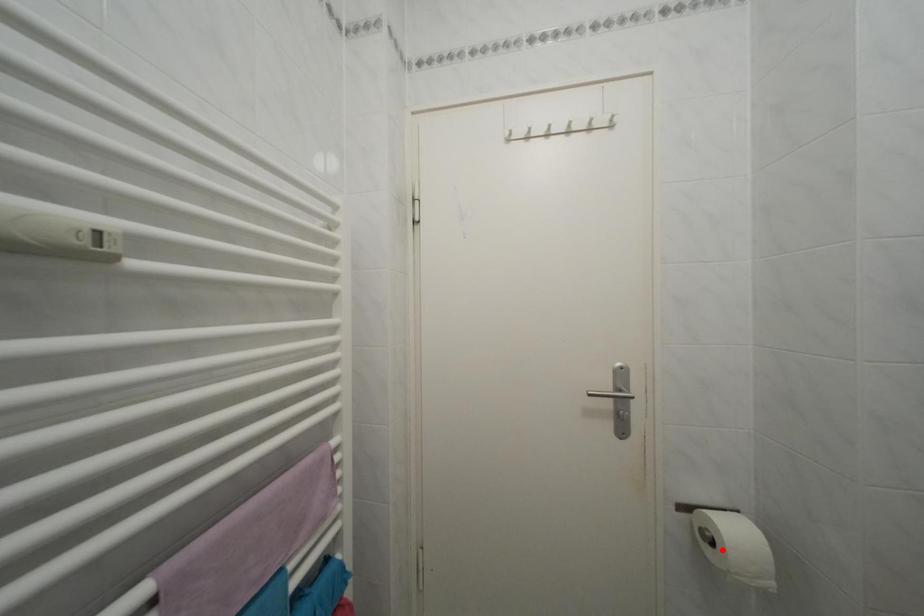
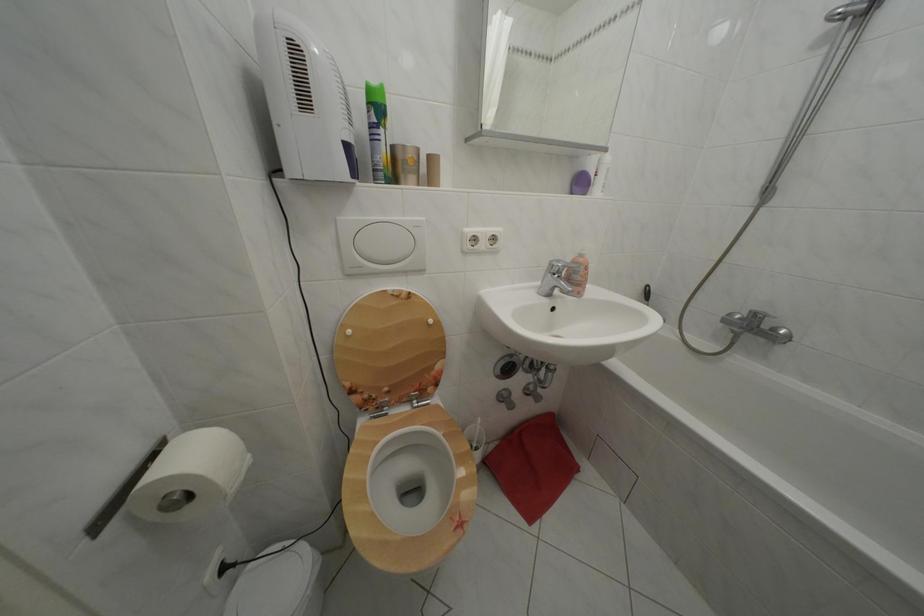
The point at the highlighted location is marked in the first image. Where is the corresponding point in the second image?

(198, 504)